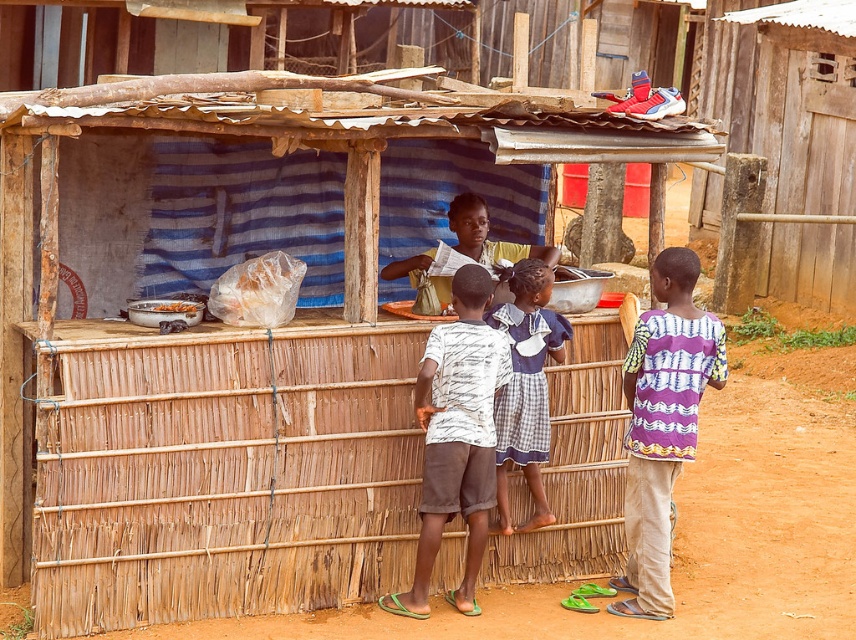
Between point (470, 445) and point (514, 452), which one is positioned behind?

Positioned behind is point (514, 452).

Is white cotton shirt at center positioned before white cotton dress at center?

Yes, it is.

Is point (421, 483) positioned after point (539, 368)?

No.

This screenshot has height=640, width=856. Identify the location of white cotton shirt at center. (456, 436).

Between purple woven shirt at right and white plastic bag at center, which one has more height?

purple woven shirt at right is taller.

Does purple woven shirt at right have a greater width compared to white plastic bag at center?

Indeed, purple woven shirt at right has a greater width compared to white plastic bag at center.

Between point (687, 259) and point (177, 305), which one is positioned in front?

Point (687, 259) is more forward.

Where is `purple woven shirt at right`? The height and width of the screenshot is (640, 856). purple woven shirt at right is located at coordinates (663, 422).

Is purple woven shirt at right below white cotton dress at center?

Yes, purple woven shirt at right is below white cotton dress at center.

Which is below, purple woven shirt at right or white cotton dress at center?

Positioned lower is purple woven shirt at right.

You are a GUI agent. You are given a task and a screenshot of the screen. Output one action in this format:
    pyautogui.click(x=<x>, y=<y>)
    Task: Click on the purple woven shirt at right
    The height and width of the screenshot is (640, 856).
    Given the screenshot: What is the action you would take?
    pyautogui.click(x=663, y=422)

This screenshot has width=856, height=640. In order to click on purple woven shirt at right in this screenshot , I will do `click(663, 422)`.